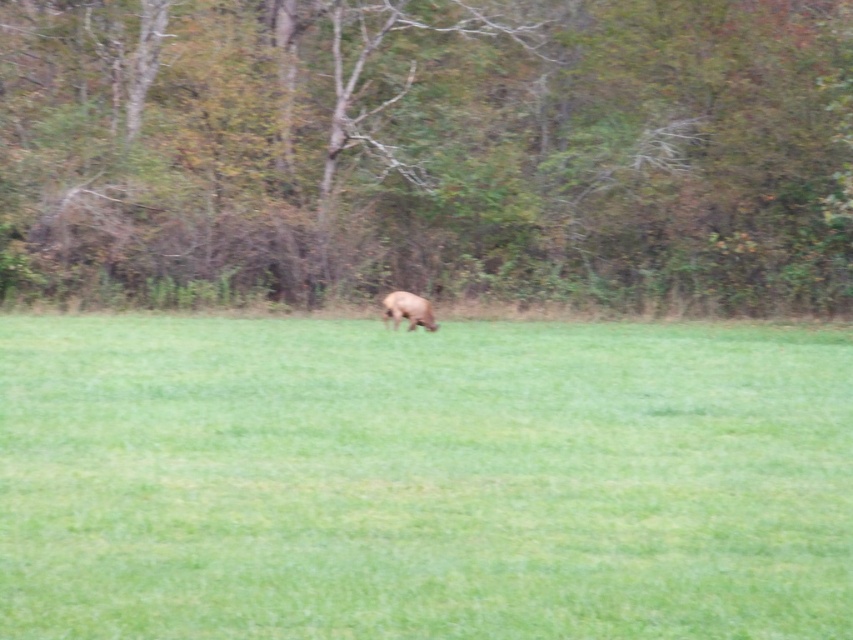
Question: Which point is closer to the camera taking this photo?

Choices:
 (A) (310, 598)
 (B) (384, 316)

Answer: (A)

Question: Is brown leafy tree at center positioned at the back of brown furry dog at center?

Choices:
 (A) no
 (B) yes

Answer: (B)

Question: Which point is closer to the camera?

Choices:
 (A) (415, 312)
 (B) (149, 211)

Answer: (A)

Question: Which point appears farthest from the camera in this image?

Choices:
 (A) (392, 292)
 (B) (218, 266)

Answer: (B)

Question: Is green grassy field at center above brown furry dog at center?

Choices:
 (A) no
 (B) yes

Answer: (A)

Question: Does green grassy field at center appear over brown leafy tree at center?

Choices:
 (A) no
 (B) yes

Answer: (A)